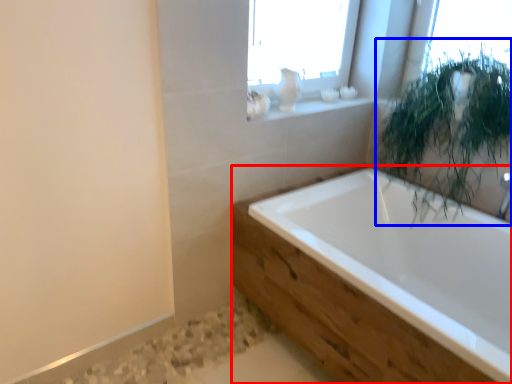
Question: Which point is further to the camera, bathtub (highlighted by a red box) or vegetation (highlighted by a blue box)?

Choices:
 (A) bathtub
 (B) vegetation

Answer: (B)